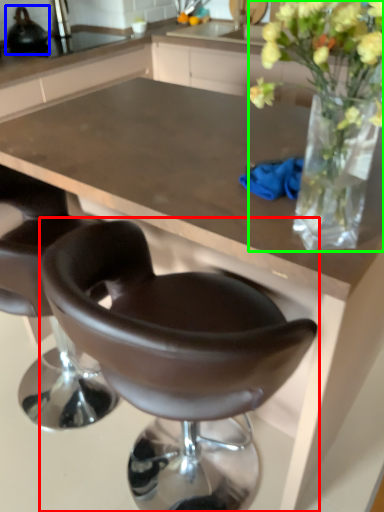
Question: Which object is the closest to the chair (highlighted by a red box)? Choose among these: appliance (highlighted by a blue box) or floral arrangement (highlighted by a green box).

Choices:
 (A) appliance
 (B) floral arrangement

Answer: (B)